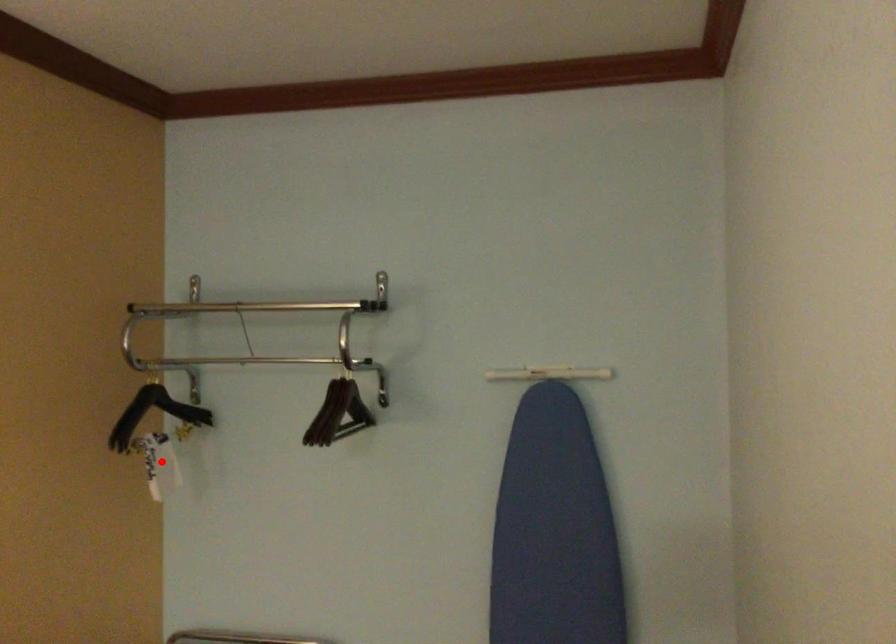
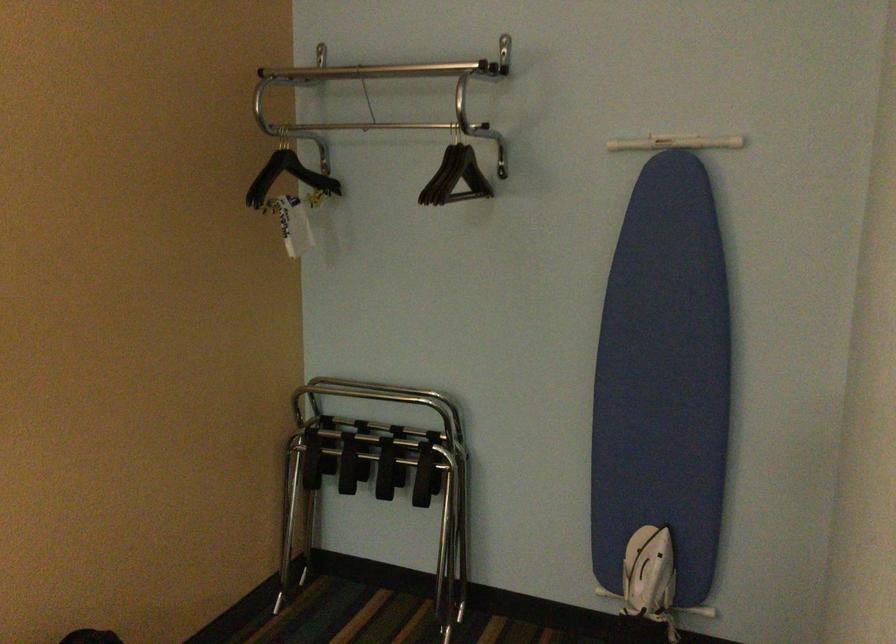
Find the pixel in the second image that matches the highlighted location in the first image.

(291, 223)